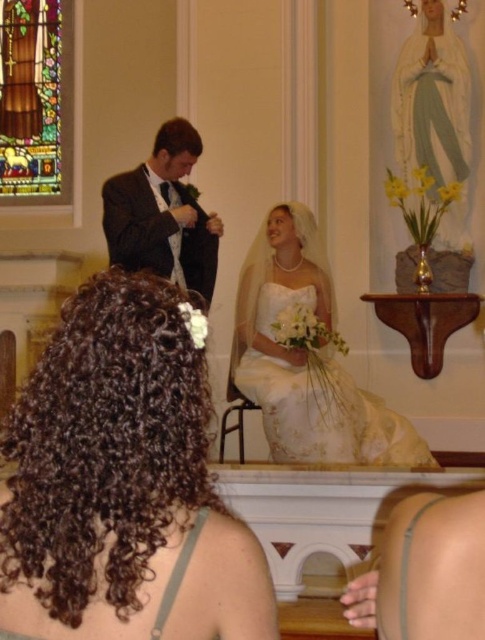
Is dark curly hair at center in front of matte black suit at center?

Yes, it is in front of matte black suit at center.

Can you confirm if dark curly hair at center is shorter than matte black suit at center?

Correct, dark curly hair at center is not as tall as matte black suit at center.

Locate an element on the screen. The image size is (485, 640). dark curly hair at center is located at coordinates (124, 481).

Which is behind, point (271, 433) or point (32, 67)?

The point (32, 67) is behind.

Consider the image. Can you confirm if white satin dress at center is wider than stained glass at upper left?

Yes, white satin dress at center is wider than stained glass at upper left.

The width and height of the screenshot is (485, 640). Describe the element at coordinates (307, 358) in the screenshot. I see `white satin dress at center` at that location.

Where is `white satin dress at center`? This screenshot has height=640, width=485. white satin dress at center is located at coordinates pos(307,358).

Can you confirm if white satin dress at center is bigger than matte black suit at center?

Yes, white satin dress at center is bigger than matte black suit at center.

Can you confirm if white satin dress at center is taller than matte black suit at center?

Indeed, white satin dress at center has a greater height compared to matte black suit at center.

Who is more forward, (416, 456) or (172, 148)?

Point (416, 456) is in front.

Find the location of a particular element. The image size is (485, 640). white satin dress at center is located at coordinates (307, 358).